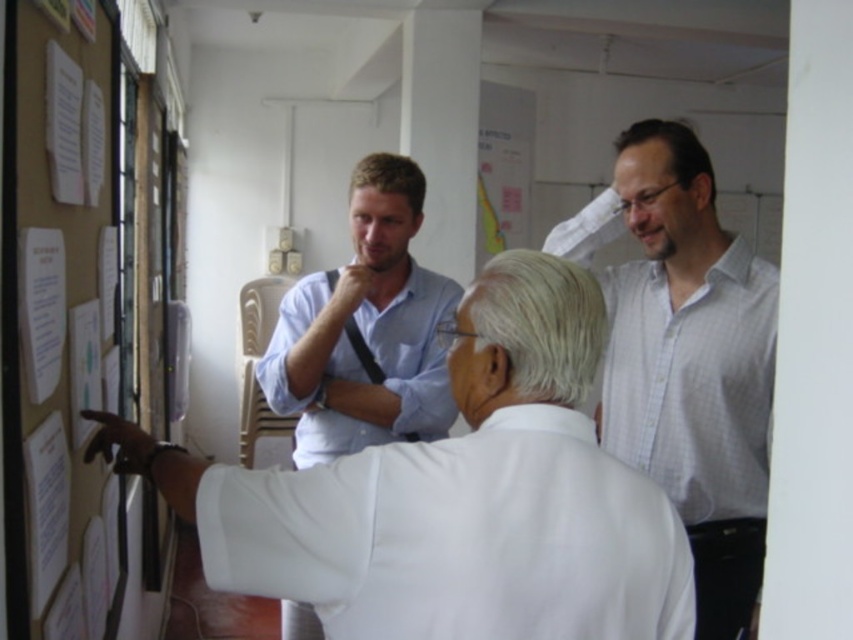
Question: Considering the real-world distances, which object is farthest from the light blue cotton shirt at center?

Choices:
 (A) white shirt at center
 (B) white matte hair at center
 (C) white checkered shirt at upper right

Answer: (B)

Question: Is white matte shirt at center below dark brown hair at upper right?

Choices:
 (A) no
 (B) yes

Answer: (B)

Question: Which point is closer to the camera taking this photo?

Choices:
 (A) (405, 237)
 (B) (415, 211)
 (C) (653, 129)
 (D) (677, 576)

Answer: (D)

Question: Considering the relative positions of white matte shirt at center and brown matte hair at center in the image provided, where is white matte shirt at center located with respect to brown matte hair at center?

Choices:
 (A) left
 (B) right

Answer: (B)

Question: Which object is closer to the camera taking this photo?

Choices:
 (A) dark brown hair at upper right
 (B) white checkered shirt at upper right

Answer: (B)

Question: Considering the relative positions of white shirt at center and brown paper bulletin board at left in the image provided, where is white shirt at center located with respect to brown paper bulletin board at left?

Choices:
 (A) below
 (B) above

Answer: (A)